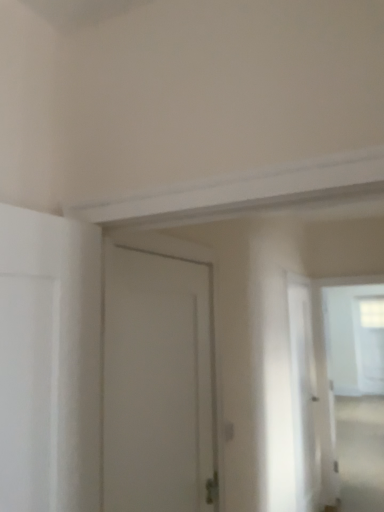
Looking at this image, measure the distance between transparent glass window at upper right and camera.

transparent glass window at upper right is 6.07 meters from camera.

This screenshot has height=512, width=384. What are the coordinates of `transparent glass window at upper right` in the screenshot? It's located at (369, 342).

This screenshot has width=384, height=512. I want to click on transparent plastic screen door at right, so click(304, 395).

Find the location of a particular element. This screenshot has width=384, height=512. transparent glass window at upper right is located at coordinates (369, 342).

Based on the photo, considering the sizes of objects transparent plastic screen door at right and white matte door at center in the image provided, who is taller, transparent plastic screen door at right or white matte door at center?

With more height is transparent plastic screen door at right.

Identify the location of screen door that appears behind the white matte door at center. (304, 395).

Which object is closer to the camera taking this photo, transparent plastic screen door at right or white matte door at center?

white matte door at center.

In terms of size, does transparent plastic screen door at right appear bigger or smaller than white matte door at center?

Clearly, transparent plastic screen door at right is larger in size than white matte door at center.

Looking at this image, from a real-world perspective, relative to transparent plastic screen door at right, is white matte door at center vertically above or below?

white matte door at center is situated higher than transparent plastic screen door at right in the real world.

Considering the sizes of objects white matte door at center and transparent plastic screen door at right in the image provided, who is thinner, white matte door at center or transparent plastic screen door at right?

With smaller width is white matte door at center.

Considering the positions of objects white matte door at center and transparent plastic screen door at right in the image provided, who is more to the right, white matte door at center or transparent plastic screen door at right?

transparent plastic screen door at right is more to the right.

In terms of height, does white matte door at center look taller or shorter compared to transparent plastic screen door at right?

Clearly, white matte door at center is shorter compared to transparent plastic screen door at right.

Does white matte door at center lie behind transparent glass window at upper right?

No, white matte door at center is closer to the viewer.

Does white matte door at center contain transparent glass window at upper right?

That's incorrect, transparent glass window at upper right is not inside white matte door at center.

Can you tell me how much white matte door at center and transparent glass window at upper right differ in facing direction?

There is a 89.3-degree angle between the facing directions of white matte door at center and transparent glass window at upper right.

Is white matte door at center looking in the opposite direction of transparent glass window at upper right?

No, transparent glass window at upper right is not at the back of white matte door at center.

From the image's perspective, which one is positioned lower, transparent glass window at upper right or transparent plastic screen door at right?

transparent glass window at upper right, from the image's perspective.

Who is taller, transparent glass window at upper right or transparent plastic screen door at right?

transparent glass window at upper right is taller.

Between point (357, 353) and point (294, 367), which one is positioned behind?

The point (357, 353) is more distant.

Is transparent glass window at upper right facing towards white matte door at center?

Yes.

How different are the orientations of transparent glass window at upper right and white matte door at center in degrees?

They differ by 89.3 degrees in their facing directions.

From a real-world perspective, who is located higher, transparent glass window at upper right or white matte door at center?

white matte door at center is physically above.

Would you consider transparent glass window at upper right to be distant from white matte door at center?

transparent glass window at upper right is positioned a significant distance from white matte door at center.

Considering the positions of objects transparent plastic screen door at right and transparent glass window at upper right in the image provided, who is in front, transparent plastic screen door at right or transparent glass window at upper right?

Positioned in front is transparent plastic screen door at right.

Is transparent plastic screen door at right turned away from transparent glass window at upper right?

transparent plastic screen door at right is not turned away from transparent glass window at upper right.

From a real-world perspective, which is physically below, transparent plastic screen door at right or transparent glass window at upper right?

transparent plastic screen door at right, from a real-world perspective.

Does transparent plastic screen door at right have a lesser width compared to transparent glass window at upper right?

Yes.

This screenshot has width=384, height=512. Identify the location of door in front of the transparent plastic screen door at right. (157, 383).

Identify the location of screen door behind the white matte door at center. (304, 395).

When comparing their distances from white matte door at center, does transparent glass window at upper right or transparent plastic screen door at right seem closer?

The object closer to white matte door at center is transparent plastic screen door at right.

Based on their spatial positions, is transparent plastic screen door at right or white matte door at center closer to transparent glass window at upper right?

Among the two, transparent plastic screen door at right is located nearer to transparent glass window at upper right.

From the image, which object appears to be farther from transparent plastic screen door at right, transparent glass window at upper right or white matte door at center?

transparent glass window at upper right.

Considering their positions, is transparent plastic screen door at right positioned further to white matte door at center than transparent glass window at upper right?

The object further to white matte door at center is transparent glass window at upper right.

Estimate the real-world distances between objects in this image. Which object is closer to transparent plastic screen door at right, white matte door at center or transparent glass window at upper right?

white matte door at center is closer to transparent plastic screen door at right.

Looking at this image, considering their positions, is white matte door at center positioned closer to transparent glass window at upper right than transparent plastic screen door at right?

The object closer to transparent glass window at upper right is transparent plastic screen door at right.

Find the location of a particular element. Image resolution: width=384 pixels, height=512 pixels. screen door between white matte door at center and transparent glass window at upper right in the front-back direction is located at coordinates (304, 395).